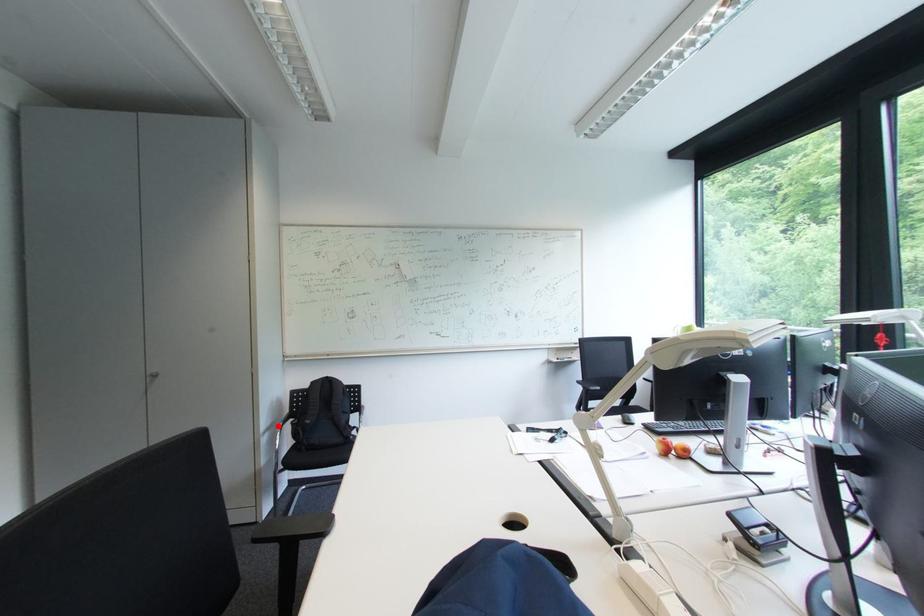
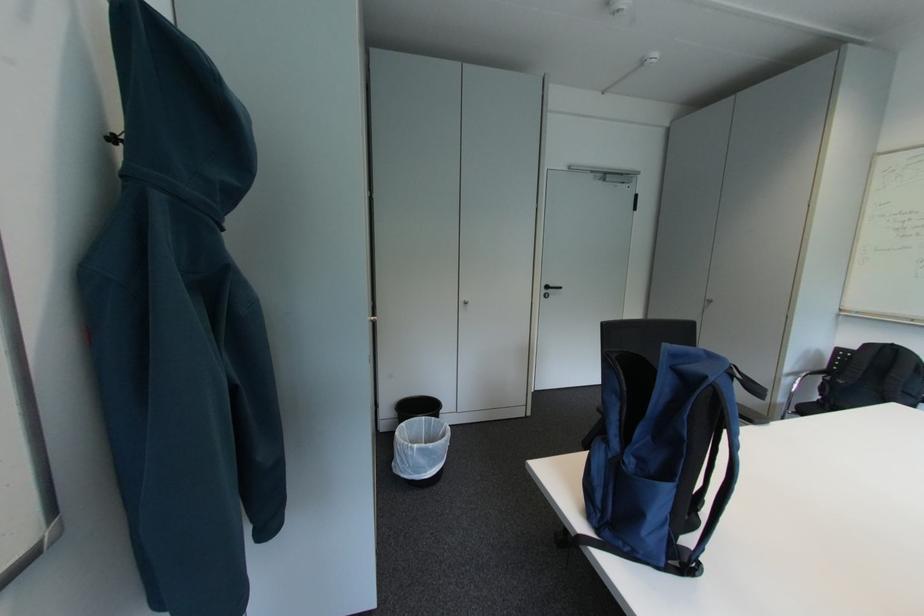
The point at the highlighted location is marked in the first image. Where is the corresponding point in the second image?

(806, 371)